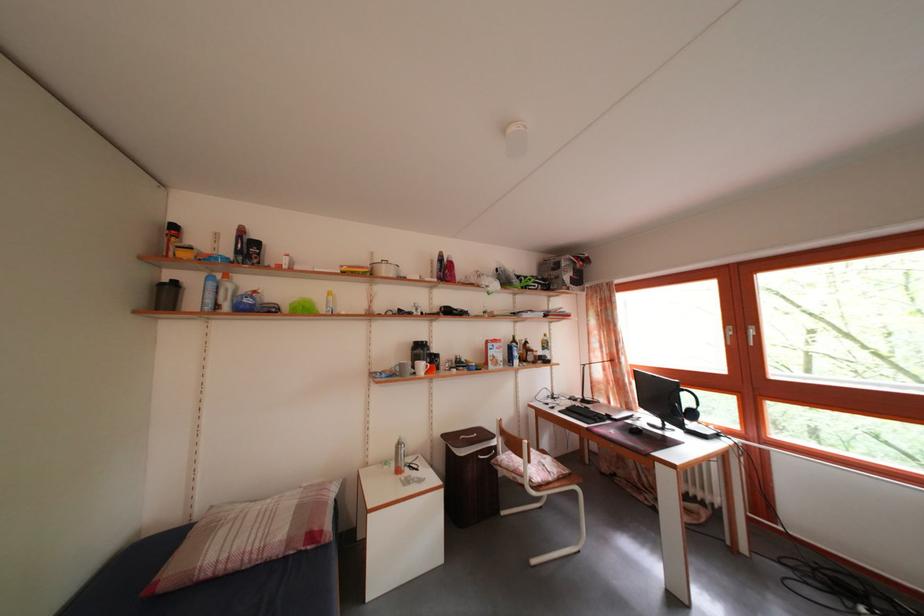
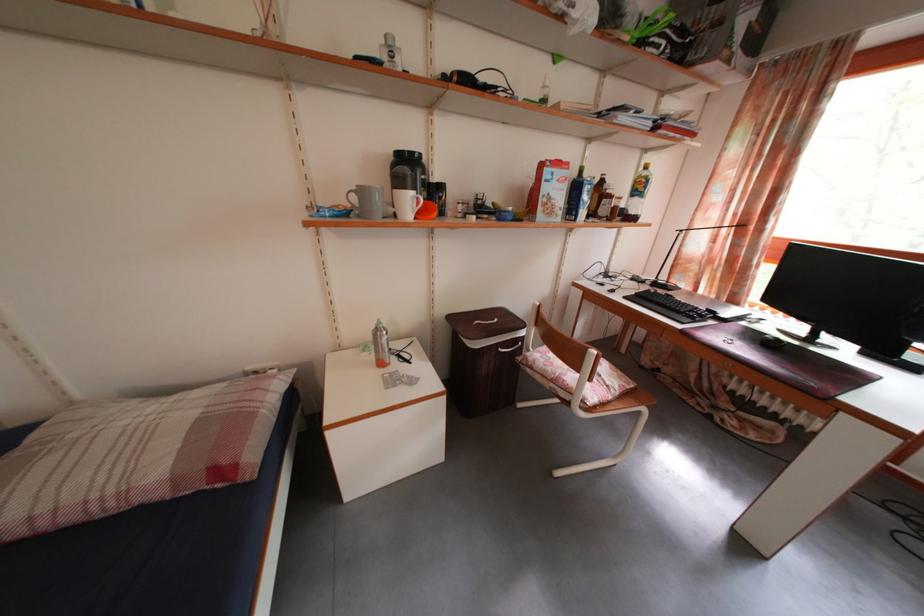
Where in the second image is the point corresponding to point (594, 403) from the first image?

(671, 285)